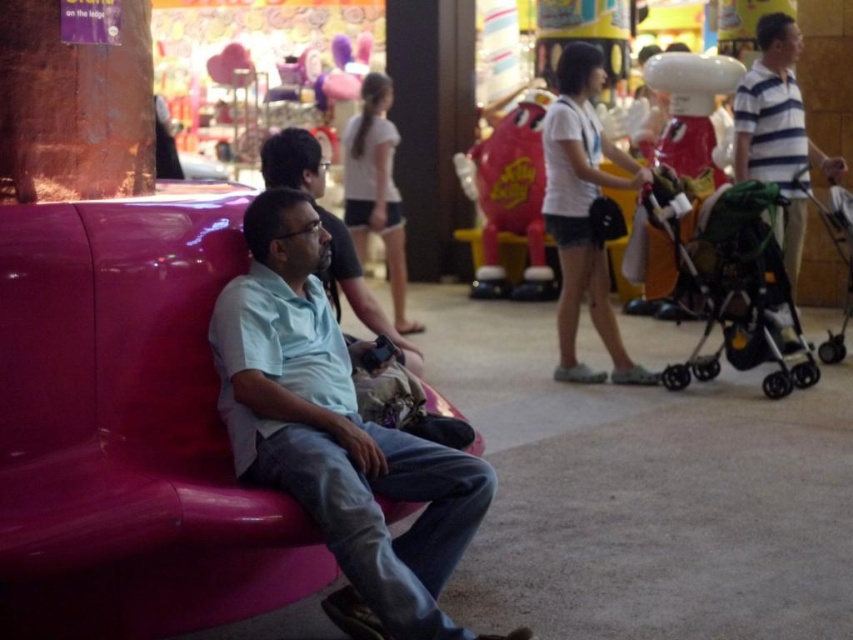
Question: Does green fabric stroller at right have a greater width compared to white matte shirt at center?

Choices:
 (A) yes
 (B) no

Answer: (A)

Question: Considering the real-world distances, which object is farthest from the light blue shirt at center?

Choices:
 (A) matte light blue shirt at center
 (B) green fabric stroller at right
 (C) white matte shirt at center

Answer: (B)

Question: Which point is closer to the camera?

Choices:
 (A) (346, 248)
 (B) (456, 476)
 (C) (740, 221)
 (D) (560, 365)

Answer: (B)

Question: Considering the relative positions of white matte shirt at center and light blue shirt at center in the image provided, where is white matte shirt at center located with respect to light blue shirt at center?

Choices:
 (A) left
 (B) right

Answer: (B)

Question: Estimate the real-world distances between objects in this image. Which object is closer to the light blue shirt at center?

Choices:
 (A) white matte shirt at center
 (B) matte light blue shirt at center

Answer: (B)

Question: Where is green fabric stroller at right located in relation to white matte shirt at center in the image?

Choices:
 (A) above
 (B) below

Answer: (B)